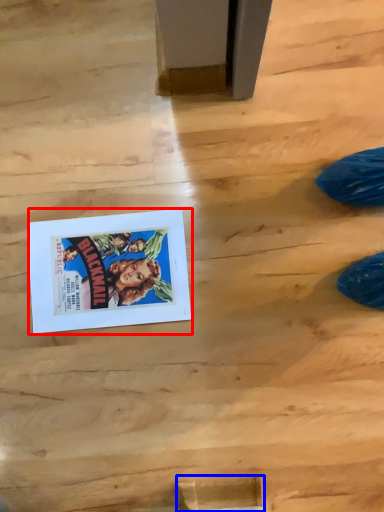
Question: Among these objects, which one is farthest to the camera, comic book (highlighted by a red box) or wood (highlighted by a blue box)?

Choices:
 (A) comic book
 (B) wood

Answer: (A)